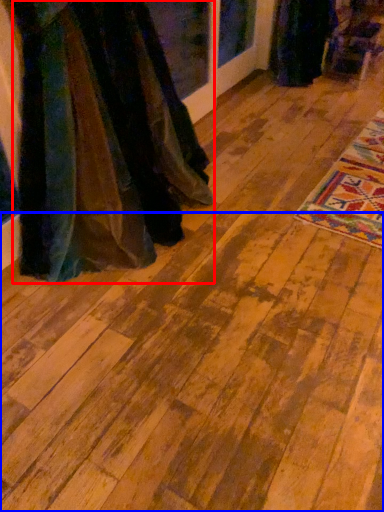
Question: Which of the following is the farthest to the observer, fancy dress (highlighted by a red box) or plywood (highlighted by a blue box)?

Choices:
 (A) fancy dress
 (B) plywood

Answer: (A)